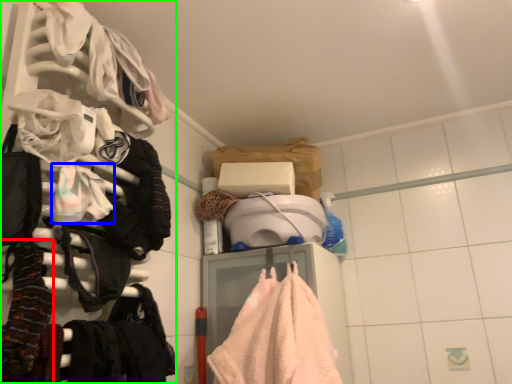
Question: Estimate the real-world distances between objects in this image. Which object is farther from clothing (highlighted by a red box), clothing (highlighted by a blue box) or closet (highlighted by a green box)?

Choices:
 (A) clothing
 (B) closet

Answer: (B)